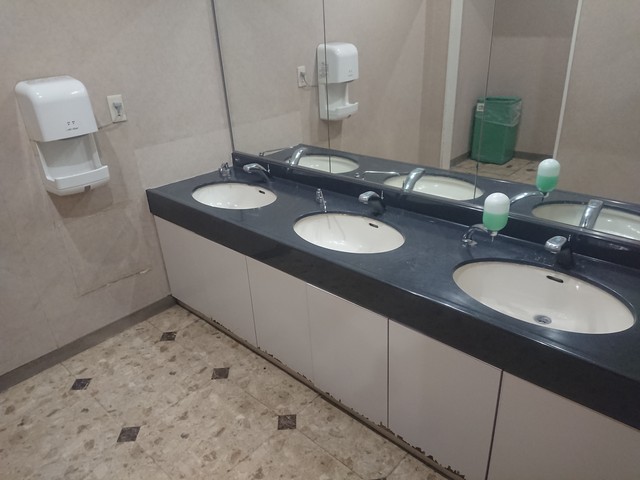
I want to click on hand dryer, so click(65, 158).